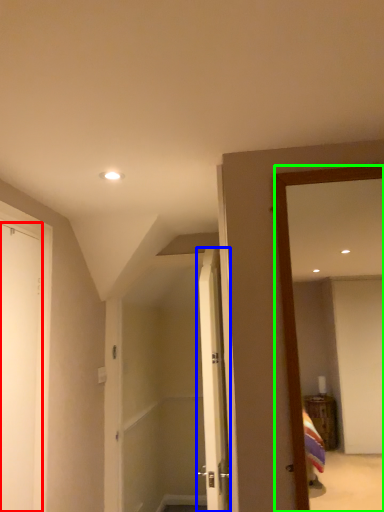
Question: Estimate the real-world distances between objects in this image. Which object is farther from door (highlighted by a red box), door (highlighted by a blue box) or mirror (highlighted by a green box)?

Choices:
 (A) door
 (B) mirror

Answer: (B)